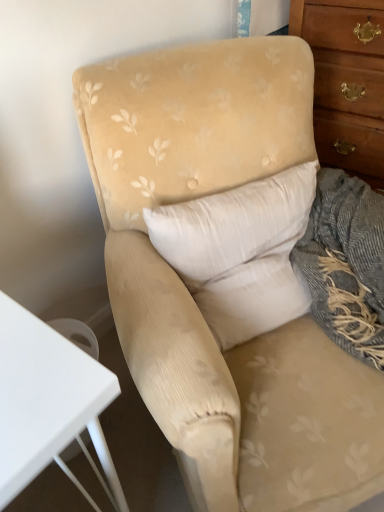
Locate an element on the screen. The width and height of the screenshot is (384, 512). beige fabric pillow at center is located at coordinates (240, 252).

Describe the element at coordinates (240, 252) in the screenshot. I see `beige fabric pillow at center` at that location.

Image resolution: width=384 pixels, height=512 pixels. Identify the location of wooden chest of drawers at right. (346, 81).

What do you see at coordinates (346, 81) in the screenshot? The image size is (384, 512). I see `wooden chest of drawers at right` at bounding box center [346, 81].

Identify the location of beige fabric pillow at center. (240, 252).

Based on their positions, is wooden chest of drawers at right located to the left or right of beige fabric pillow at center?

Based on their positions, wooden chest of drawers at right is located to the right of beige fabric pillow at center.

Is wooden chest of drawers at right behind beige fabric pillow at center?

Yes, the depth of wooden chest of drawers at right is greater than that of beige fabric pillow at center.

Between point (328, 104) and point (283, 244), which one is positioned behind?

Point (328, 104)

From the image's perspective, which object appears higher, wooden chest of drawers at right or beige fabric pillow at center?

wooden chest of drawers at right, from the image's perspective.

From a real-world perspective, which object stands above the other?

From a 3D spatial view, beige fabric pillow at center is above.

Between wooden chest of drawers at right and beige fabric pillow at center, which one has larger width?

wooden chest of drawers at right.

Can you confirm if wooden chest of drawers at right is shorter than beige fabric pillow at center?

No, wooden chest of drawers at right is not shorter than beige fabric pillow at center.

Between wooden chest of drawers at right and beige fabric pillow at center, which one has larger size?

wooden chest of drawers at right.

Can we say wooden chest of drawers at right lies outside beige fabric pillow at center?

Indeed, wooden chest of drawers at right is completely outside beige fabric pillow at center.

Would you consider wooden chest of drawers at right to be distant from beige fabric pillow at center?

That's not correct — wooden chest of drawers at right is a little close to beige fabric pillow at center.

Is wooden chest of drawers at right oriented towards beige fabric pillow at center?

Yes, wooden chest of drawers at right is turned towards beige fabric pillow at center.

How distant is wooden chest of drawers at right from beige fabric pillow at center?

They are 27.76 inches apart.

Where is `chest of drawers below the beige fabric pillow at center (from a real-world perspective)`? This screenshot has height=512, width=384. chest of drawers below the beige fabric pillow at center (from a real-world perspective) is located at coordinates (346, 81).

Considering the relative positions of beige fabric pillow at center and wooden chest of drawers at right in the image provided, is beige fabric pillow at center to the left or to the right of wooden chest of drawers at right?

beige fabric pillow at center is to the left of wooden chest of drawers at right.

Is beige fabric pillow at center in front of or behind wooden chest of drawers at right in the image?

Clearly, beige fabric pillow at center is in front of wooden chest of drawers at right.

Does point (221, 318) lie in front of point (310, 23)?

Yes, point (221, 318) is closer to viewer.

From the image's perspective, relative to wooden chest of drawers at right, is beige fabric pillow at center above or below?

Clearly, from the image's perspective, beige fabric pillow at center is below wooden chest of drawers at right.

From a real-world perspective, which object stands above the other?

beige fabric pillow at center.

Is beige fabric pillow at center wider or thinner than wooden chest of drawers at right?

Considering their sizes, beige fabric pillow at center looks slimmer than wooden chest of drawers at right.

In terms of height, does beige fabric pillow at center look taller or shorter compared to wooden chest of drawers at right?

beige fabric pillow at center is shorter than wooden chest of drawers at right.

Does beige fabric pillow at center have a smaller size compared to wooden chest of drawers at right?

Yes.

Is beige fabric pillow at center inside or outside of wooden chest of drawers at right?

beige fabric pillow at center is located beyond the bounds of wooden chest of drawers at right.

Is beige fabric pillow at center positioned far away from wooden chest of drawers at right?

Actually, beige fabric pillow at center and wooden chest of drawers at right are a little close together.

Consider the image. Is beige fabric pillow at center oriented towards wooden chest of drawers at right?

No, beige fabric pillow at center is not turned towards wooden chest of drawers at right.

How different are the orientations of beige fabric pillow at center and wooden chest of drawers at right in degrees?

The angle between the facing direction of beige fabric pillow at center and the facing direction of wooden chest of drawers at right is 62.1 degrees.

You are a GUI agent. You are given a task and a screenshot of the screen. Output one action in this format:
    pyautogui.click(x=<x>, y=<y>)
    Task: Click on the pillow below the wooden chest of drawers at right (from the image's perspective)
    The image size is (384, 512).
    Given the screenshot: What is the action you would take?
    pyautogui.click(x=240, y=252)

Where is `pillow that is in front of the wooden chest of drawers at right`? pillow that is in front of the wooden chest of drawers at right is located at coordinates (240, 252).

This screenshot has height=512, width=384. In the image, there is a beige fabric pillow at center. Find the location of `the chest of drawers below it (from a real-world perspective)`. the chest of drawers below it (from a real-world perspective) is located at coordinates (346, 81).